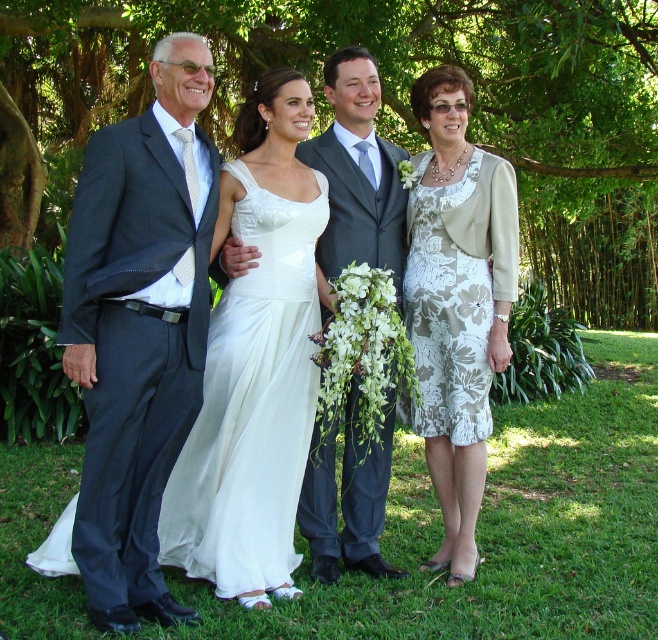
Who is taller, floral-patterned dress at center or floral-patterned fabric dress at right?

floral-patterned dress at center

Find the location of a particular element. floral-patterned dress at center is located at coordinates (457, 304).

Between point (424, 189) and point (436, 358), which one is positioned behind?

Point (424, 189)

Locate an element on the screen. This screenshot has height=640, width=658. floral-patterned dress at center is located at coordinates (457, 304).

Between point (145, 444) and point (490, 381), which one is positioned behind?

The point (490, 381) is behind.

Does dark gray suit at left appear over floral-patterned fabric dress at right?

No, dark gray suit at left is not above floral-patterned fabric dress at right.

The image size is (658, 640). Identify the location of dark gray suit at left. (139, 328).

Locate an element on the screen. green leafy tree at upper center is located at coordinates (397, 106).

Between point (549, 128) and point (422, 413), which one is positioned in front?

Positioned in front is point (422, 413).

Between point (353, 28) and point (470, 273), which one is positioned behind?

The point (353, 28) is more distant.

Locate an element on the screen. This screenshot has height=640, width=658. green leafy tree at upper center is located at coordinates (397, 106).